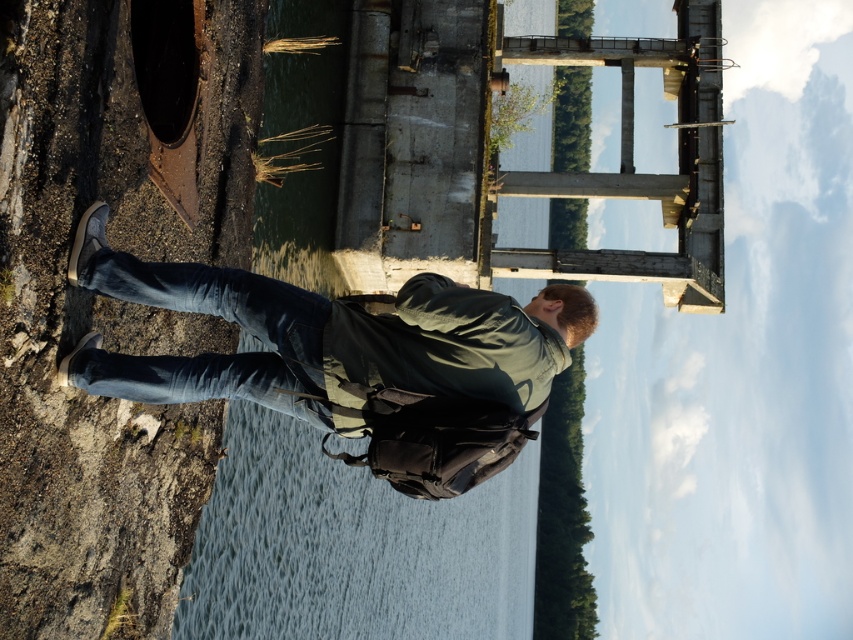
Does rusty metal cliff at lower left appear over denim jacket at center?

No, rusty metal cliff at lower left is not above denim jacket at center.

Is rusty metal cliff at lower left closer to the viewer compared to denim jacket at center?

Yes, it is in front of denim jacket at center.

Locate an element on the screen. rusty metal cliff at lower left is located at coordinates click(111, 300).